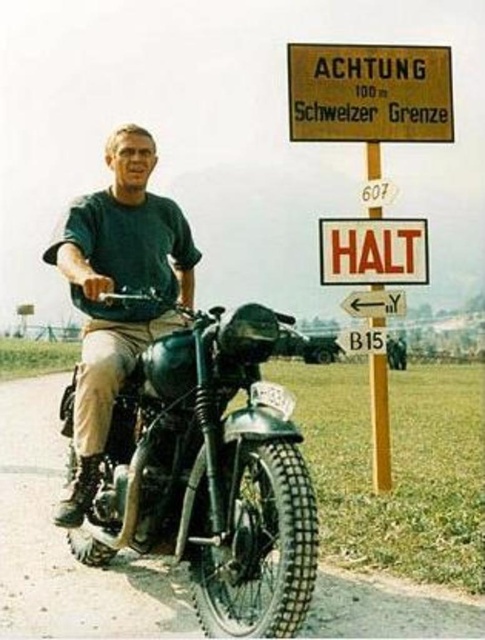
You are a delivery driver who needs to pass through a narrow alley that is only 1.5 meters wide. You have a shiny black motorcycle at center and an orange plastic sign at center. Which one can fit through the alley without needing to adjust its position?

The orange plastic sign at center can fit through the alley since it is narrower than the shiny black motorcycle at center, which is wider than the alley.

What is located at the coordinates point (210, 474)?

The shiny black motorcycle at center is located at point (210, 474).